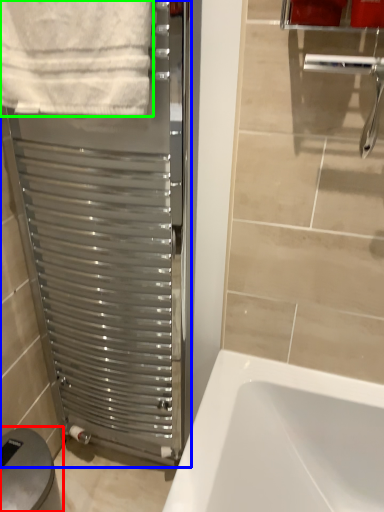
Question: Which object is the closest to the gray (highlighted by a red box)? Choose among these: screen door (highlighted by a blue box) or towel (highlighted by a green box).

Choices:
 (A) screen door
 (B) towel

Answer: (A)